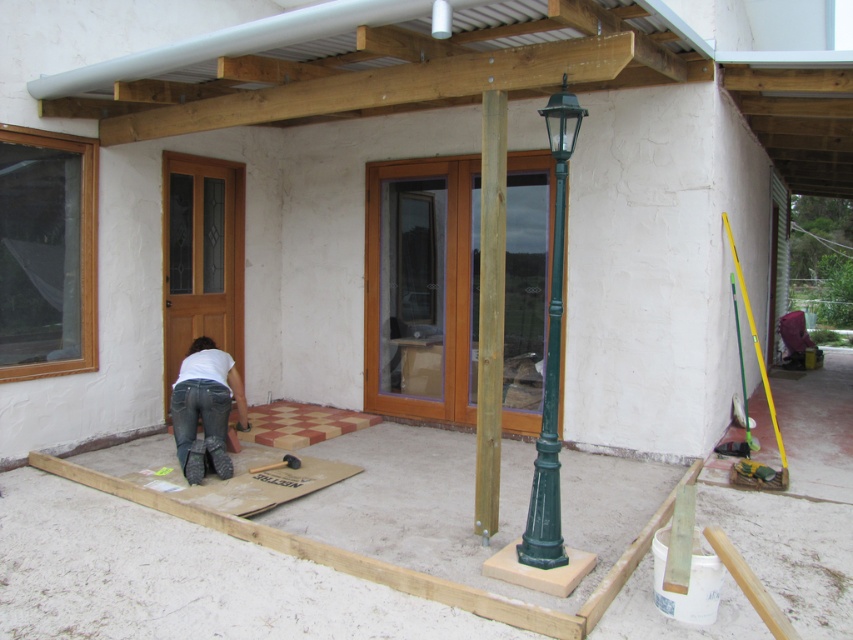
You are a construction worker who needs to choose a pole to support a new structure. The brown wooden pole at center and the green painted metal pole at center are available. Which pole is more suitable if you need a larger one?

The green painted metal pole at center is larger than the brown wooden pole at center, so it is more suitable for supporting the new structure if a larger pole is needed.